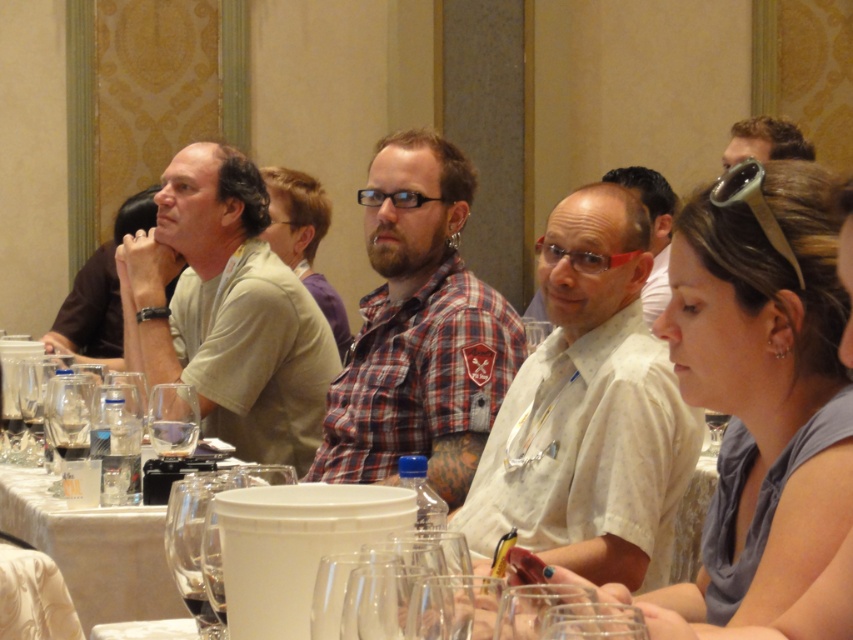
How far apart are white dotted shirt at center and matte black shirt at left?

The distance of white dotted shirt at center from matte black shirt at left is 3.08 meters.

Is point (563, 497) positioned after point (85, 349)?

That is False.

Find the location of a particular element. The height and width of the screenshot is (640, 853). white dotted shirt at center is located at coordinates (589, 412).

At what (x,y) coordinates should I click in order to perform the action: click on white dotted shirt at center. Please return your answer as a coordinate pair (x, y). The height and width of the screenshot is (640, 853). Looking at the image, I should click on (589, 412).

Can you confirm if plaid fabric shirt at center is thinner than clear glass wine glass at center?

In fact, plaid fabric shirt at center might be wider than clear glass wine glass at center.

Who is taller, plaid fabric shirt at center or clear glass wine glass at center?

plaid fabric shirt at center

Is point (341, 433) positioned before point (171, 396)?

No, it is not.

The width and height of the screenshot is (853, 640). In order to click on plaid fabric shirt at center in this screenshot , I will do `click(419, 330)`.

Can you confirm if light beige cotton shirt at left is positioned below matte white shirt at center?

Indeed, light beige cotton shirt at left is positioned under matte white shirt at center.

Can you confirm if light beige cotton shirt at left is bigger than matte white shirt at center?

Incorrect, light beige cotton shirt at left is not larger than matte white shirt at center.

This screenshot has width=853, height=640. I want to click on light beige cotton shirt at left, so click(x=225, y=310).

What are the coordinates of `light beige cotton shirt at left` in the screenshot? It's located at (225, 310).